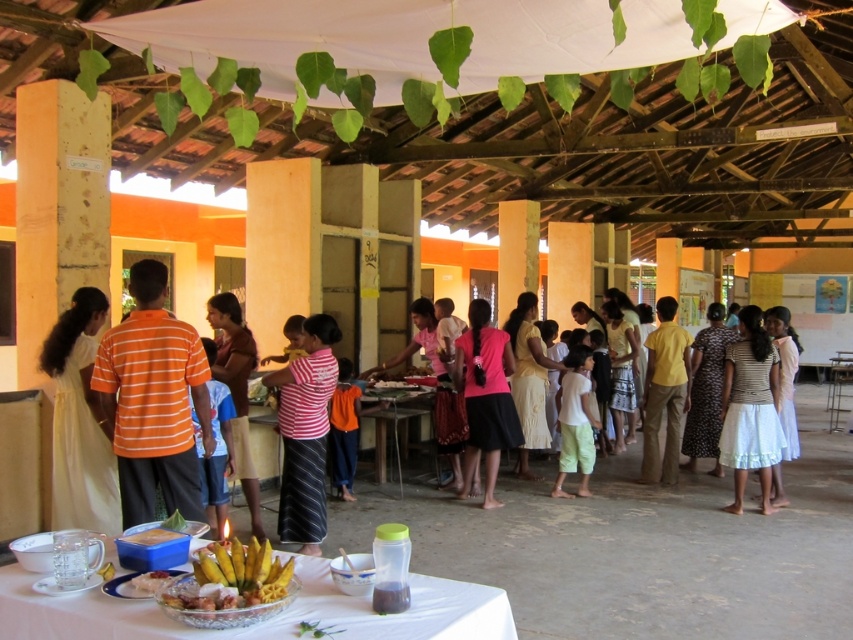
Question: Among these objects, which one is nearest to the camera?

Choices:
 (A) yellow shiny bananas at center
 (B) metallic silver table at center

Answer: (A)

Question: Does pink fabric skirt at center appear on the right side of metallic silver table at center?

Choices:
 (A) yes
 (B) no

Answer: (A)

Question: Can you confirm if white satin dress at left is positioned to the right of metallic silver table at center?

Choices:
 (A) no
 (B) yes

Answer: (A)

Question: Which of these objects is positioned farthest from the wooden table at center?

Choices:
 (A) metallic silver table at center
 (B) white glossy rice at lower center
 (C) striped fabric skirt at center

Answer: (B)

Question: Does orange striped shirt at left appear under wooden table at center?

Choices:
 (A) yes
 (B) no

Answer: (B)

Question: Which object is farther from the camera taking this photo?

Choices:
 (A) pink fabric skirt at center
 (B) white glossy rice at lower center
 (C) orange striped shirt at left
 (D) clear glass bowl at center

Answer: (A)